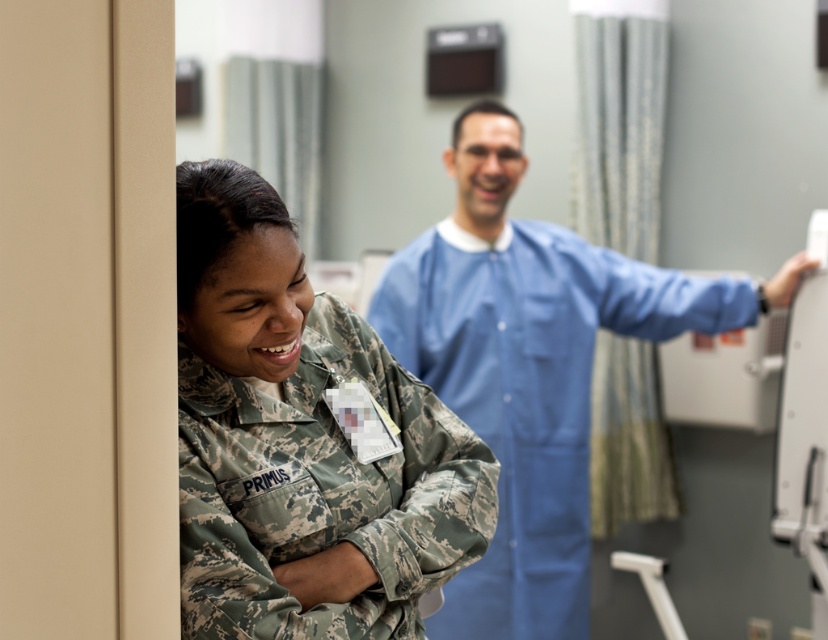
Question: Is camouflage uniform at left smaller than blue smooth lab coat at center?

Choices:
 (A) no
 (B) yes

Answer: (B)

Question: Does camouflage uniform at left have a greater width compared to blue smooth lab coat at center?

Choices:
 (A) no
 (B) yes

Answer: (A)

Question: Which point is closer to the camera taking this photo?

Choices:
 (A) (566, 291)
 (B) (354, 557)

Answer: (B)

Question: Which point is closer to the camera taking this photo?

Choices:
 (A) (465, 584)
 (B) (368, 380)

Answer: (B)

Question: Can you confirm if camouflage uniform at left is wider than blue smooth lab coat at center?

Choices:
 (A) yes
 (B) no

Answer: (B)